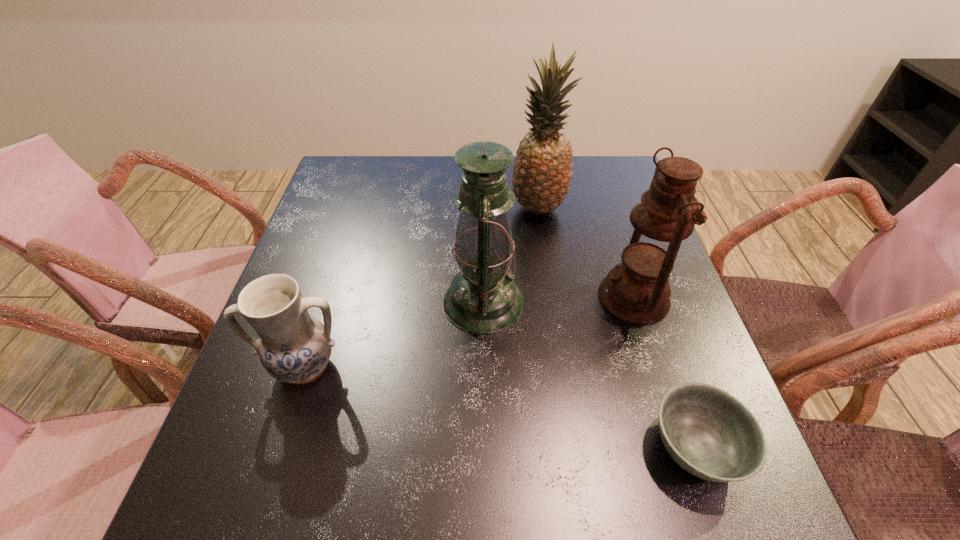
This screenshot has width=960, height=540. What are the coordinates of `vacant area at the near edge of the desktop` in the screenshot? It's located at (426, 526).

In the image, there is a desktop. Identify the location of vacant space at the left edge. The width and height of the screenshot is (960, 540). (369, 221).

At what (x,y) coordinates should I click in order to perform the action: click on vacant space at the right edge. Please return your answer as a coordinate pair (x, y). The width and height of the screenshot is (960, 540). Looking at the image, I should click on (607, 254).

Identify the location of blank space at the far left corner. (375, 192).

Where is `vacant space at the far right corner`? This screenshot has height=540, width=960. vacant space at the far right corner is located at coordinates (600, 180).

The width and height of the screenshot is (960, 540). I want to click on vacant space that's between the fourth farthest object and the nearest object, so click(x=501, y=407).

Find the location of a particular element. The height and width of the screenshot is (540, 960). free space between the pineapple and the nearest object is located at coordinates (617, 328).

The image size is (960, 540). I want to click on free space between the second shortest object and the nearest object, so click(x=501, y=407).

Locate an element on the screen. This screenshot has height=540, width=960. vacant area between the shorter oil lamp and the farthest object is located at coordinates (586, 253).

You are a GUI agent. You are given a task and a screenshot of the screen. Output one action in this format:
    pyautogui.click(x=<x>, y=<y>)
    Task: Click on the empty space between the left oil lamp and the second shortest object
    The image size is (960, 540).
    Given the screenshot: What is the action you would take?
    pyautogui.click(x=395, y=334)